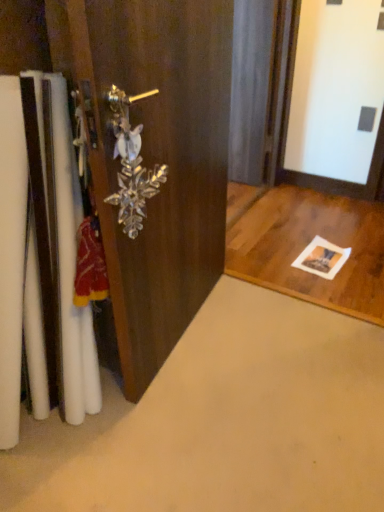
Question: Does point (205, 84) appear closer or farther from the camera than point (119, 157)?

Choices:
 (A) farther
 (B) closer

Answer: (A)

Question: In terms of height, does wooden door handle at left look taller or shorter compared to clear crystal handle at center?

Choices:
 (A) tall
 (B) short

Answer: (A)

Question: Considering their positions, is wooden door handle at left located in front of or behind clear crystal handle at center?

Choices:
 (A) behind
 (B) front

Answer: (B)

Question: From the image's perspective, is clear crystal handle at center positioned above or below wooden door handle at left?

Choices:
 (A) below
 (B) above

Answer: (A)

Question: Considering the positions of point (127, 199) and point (185, 237), is point (127, 199) closer or farther from the camera than point (185, 237)?

Choices:
 (A) farther
 (B) closer

Answer: (B)

Question: Is clear crystal handle at center to the left or to the right of wooden door handle at left in the image?

Choices:
 (A) right
 (B) left

Answer: (B)

Question: Is clear crystal handle at center taller or shorter than wooden door handle at left?

Choices:
 (A) tall
 (B) short

Answer: (B)